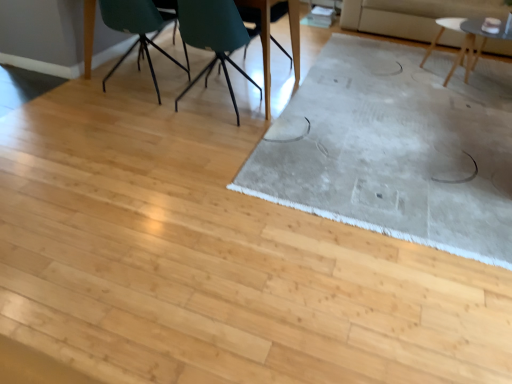
Question: Based on their positions, is beige fabric couch at upper right located to the left or right of light gray textured rug at center?

Choices:
 (A) right
 (B) left

Answer: (A)

Question: In the image, is beige fabric couch at upper right positioned in front of or behind light gray textured rug at center?

Choices:
 (A) behind
 (B) front

Answer: (A)

Question: Considering the real-world distances, which object is farthest from the matte wood table at upper center, marked as the 2th table in a right-to-left arrangement?

Choices:
 (A) light gray textured rug at center
 (B) wooden chair at center, which is the first chair in right-to-left order
 (C) white glossy table at upper right, arranged as the 1th table when viewed from the right
 (D) teal plastic chair at upper center, which ranks as the 2th chair in left-to-right order
 (E) beige fabric couch at upper right

Answer: (C)

Question: Based on their relative distances, which object is nearer to the beige fabric couch at upper right?

Choices:
 (A) matte wood table at upper center, marked as the 2th table in a right-to-left arrangement
 (B) matte teal chair at upper left, which ranks as the first chair in left-to-right order
 (C) white glossy table at upper right, which is the 2th table in left-to-right order
 (D) wooden chair at center, positioned as the third chair in left-to-right order
 (E) light gray textured rug at center

Answer: (C)